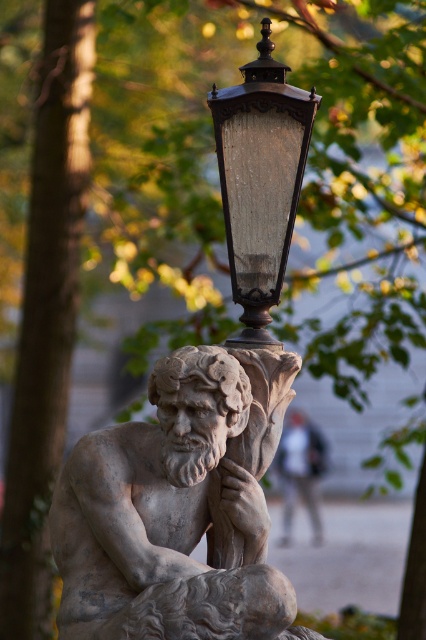
You are a photographer aiming to capture the stone statue at center without the wooden textured lantern at upper center appearing in the frame. Based on their positions, is this possible?

The stone statue at center is in front of the wooden textured lantern at upper center, so the statue will block the lantern from view. Therefore, it is possible to capture the stone statue at center without the wooden textured lantern at upper center in the frame by positioning the camera so the statue obscures the lantern.

You are a maintenance worker needing to reach the wooden textured lantern at upper center from the stone statue at center. Given that your ladder is 3 meters long, can you safely reach the lantern without extending it further?

The distance between the stone statue at center and wooden textured lantern at upper center is 3.26 meters. Since the ladder is only 3 meters long, it is not long enough to safely reach the lantern without extending it further.

You are an artist planning to sketch the scene. You need to ensure the proportions between the stone statue at center and the wooden textured lantern at upper center are accurate. Which object should you draw as shorter?

The stone statue at center should be drawn as shorter than the wooden textured lantern at upper center since the description states that the stone statue at center is not as tall as the wooden textured lantern at upper center.